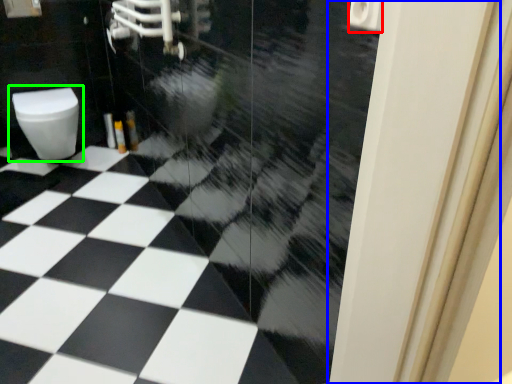
Question: Considering the real-world distances, which object is closest to toilet paper (highlighted by a red box)? screen door (highlighted by a blue box) or toilet (highlighted by a green box).

Choices:
 (A) screen door
 (B) toilet

Answer: (A)